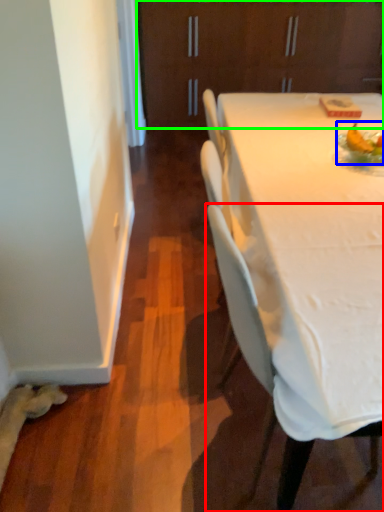
Question: Which is farther away from chair (highlighted by a red box)? food (highlighted by a blue box) or cabinetry (highlighted by a green box)?

Choices:
 (A) food
 (B) cabinetry

Answer: (B)